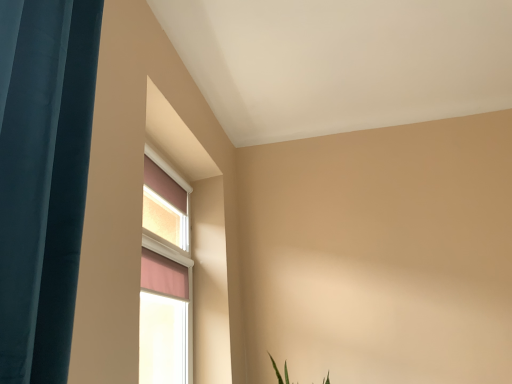
Question: In terms of size, does teal fabric curtain at left appear bigger or smaller than pink fabric window at upper left?

Choices:
 (A) small
 (B) big

Answer: (B)

Question: Is point (90, 66) positioned closer to the camera than point (158, 288)?

Choices:
 (A) farther
 (B) closer

Answer: (B)

Question: Considering the positions of teal fabric curtain at left and pink fabric window at upper left in the image, is teal fabric curtain at left taller or shorter than pink fabric window at upper left?

Choices:
 (A) short
 (B) tall

Answer: (A)

Question: Is pink fabric window at upper left bigger or smaller than teal fabric curtain at left?

Choices:
 (A) small
 (B) big

Answer: (A)

Question: Looking at their shapes, would you say pink fabric window at upper left is wider or thinner than teal fabric curtain at left?

Choices:
 (A) thin
 (B) wide

Answer: (A)

Question: From a real-world perspective, is pink fabric window at upper left physically located above or below teal fabric curtain at left?

Choices:
 (A) above
 (B) below

Answer: (B)

Question: Relative to teal fabric curtain at left, is pink fabric window at upper left in front or behind?

Choices:
 (A) front
 (B) behind

Answer: (B)